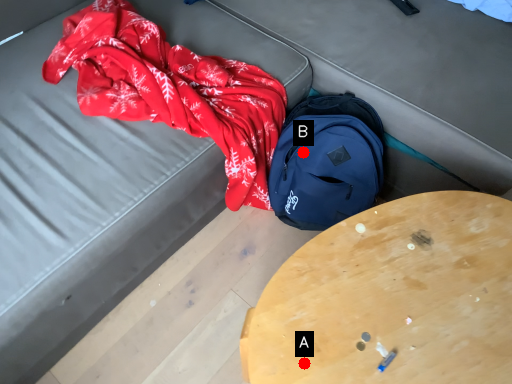
Question: Two points are circled on the image, labeled by A and B beside each circle. Which of the following is the farthest from the observer?

Choices:
 (A) A is further
 (B) B is further

Answer: (B)